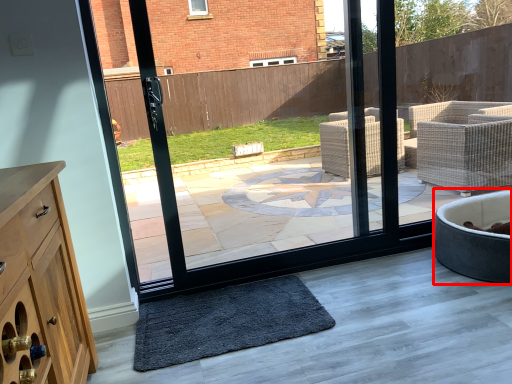
Question: From the image's perspective, where is bath (annotated by the red box) located relative to mat?

Choices:
 (A) below
 (B) above

Answer: (B)